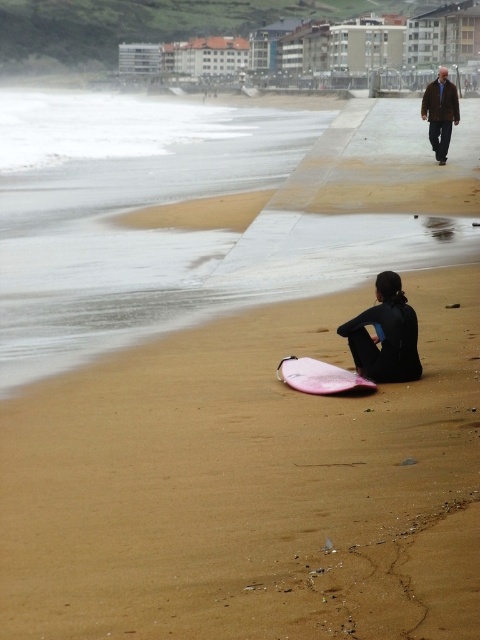
Question: Does pink matte surfboard at center appear over dark brown leather jacket at upper right?

Choices:
 (A) no
 (B) yes

Answer: (A)

Question: Based on their relative distances, which object is farther from the dark brown leather jacket at upper right?

Choices:
 (A) pink matte surfboard at center
 (B) black matte wetsuit at lower center

Answer: (A)

Question: Can you confirm if black matte wetsuit at lower center is positioned to the right of pink matte surfboard at center?

Choices:
 (A) no
 (B) yes

Answer: (B)

Question: Which of these objects is positioned farthest from the black matte wetsuit at lower center?

Choices:
 (A) pink matte surfboard at center
 (B) dark brown leather jacket at upper right

Answer: (B)

Question: Does pink matte surfboard at center have a greater width compared to dark brown leather jacket at upper right?

Choices:
 (A) no
 (B) yes

Answer: (A)

Question: Among these objects, which one is nearest to the camera?

Choices:
 (A) pink matte surfboard at center
 (B) dark brown leather jacket at upper right
 (C) black matte wetsuit at lower center

Answer: (A)